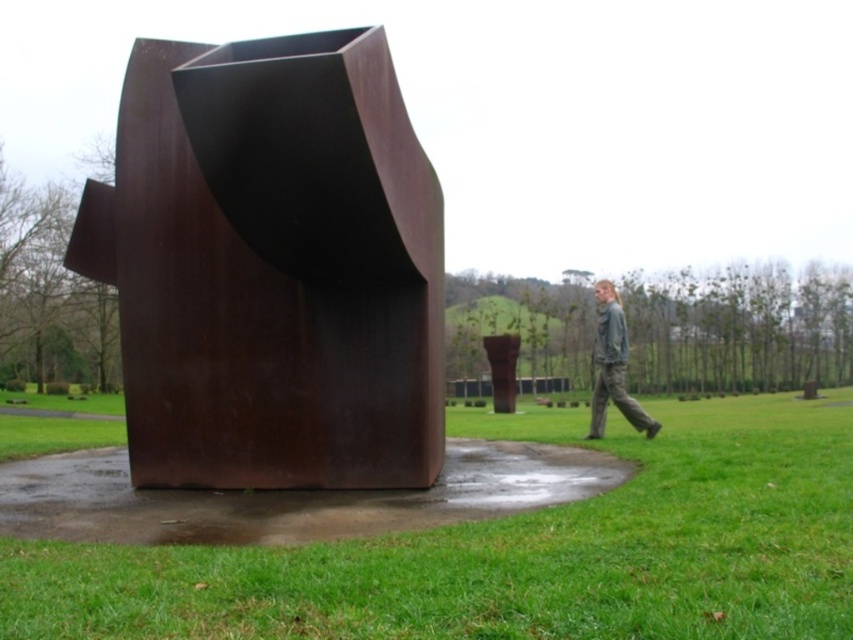
You are standing in the park and want to take a photo of the sculpture. You notice two points marked on the ground at coordinates point (125, 212) and point (312, 547). Which point should you stand closer to in order to ensure the sculpture is fully visible in your photo?

You should stand closer to point (312, 547) because point (125, 212) is behind it, meaning the sculpture might be partially blocked from that position.

You are standing at the origin point of the coordinate system, which is at the bottom left corner of the image. The rusty metal sculpture at center is located at point (x=271, y=266). If you want to walk directly towards the sculpture, in which direction should you move?

You should move northeast because the point (x=271, y=266) is northeast of the origin at the bottom left corner.

From the picture: You are a photographer trying to capture the rusty metal sculpture at center and the gray cotton pants at lower right in the same frame. Based on their positions, which object is located to the left of the other?

The rusty metal sculpture at center is positioned on the left side of gray cotton pants at lower right.